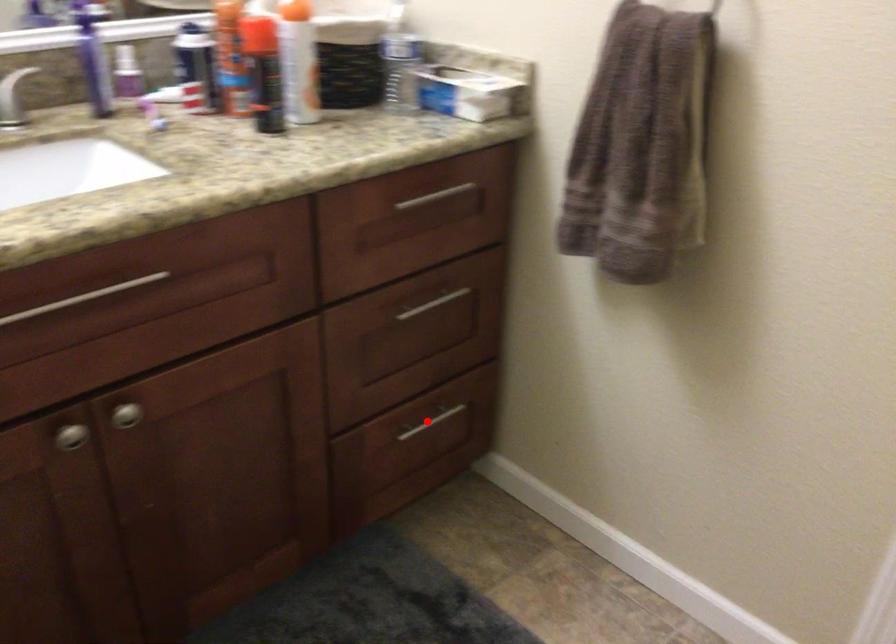
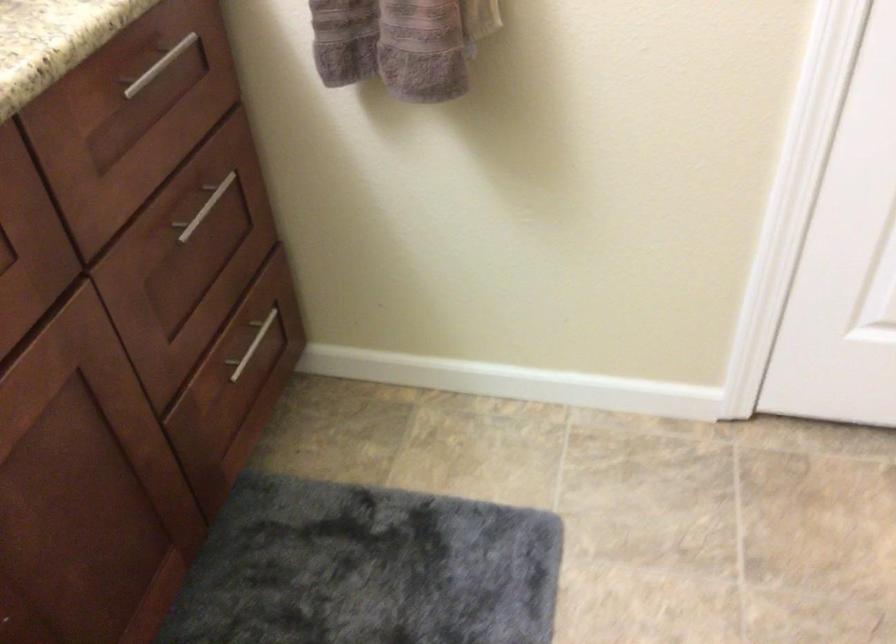
Question: I am providing you with two images of the same scene from different viewpoints. A red point is shown in image1. For the corresponding object point in image2, is it positioned nearer or farther from the camera?

Choices:
 (A) Nearer
 (B) Farther

Answer: (A)